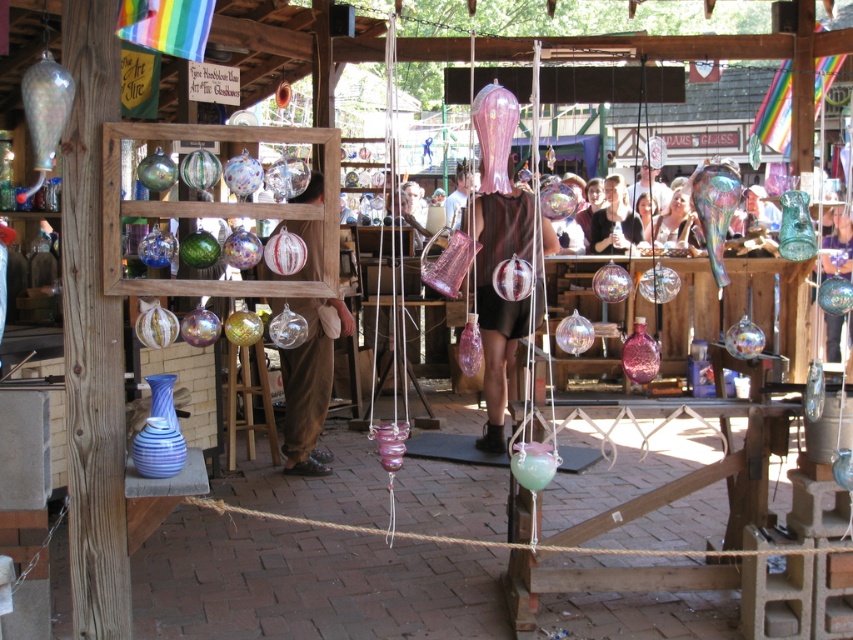
Question: Which of the following is the farthest from the observer?

Choices:
 (A) (500, 445)
 (B) (659, 227)

Answer: (B)

Question: Does matte brown pants at center appear over brown rope at center?

Choices:
 (A) no
 (B) yes

Answer: (B)

Question: Considering the real-world distances, which object is farthest from the matte brown pants at center?

Choices:
 (A) translucent glass vase at center
 (B) matte black dress at center
 (C) matte black shirt at center
 (D) translucent pink glass vase at center

Answer: (A)

Question: Is translucent pink glass vase at center closer to the viewer compared to matte brown pants at center?

Choices:
 (A) yes
 (B) no

Answer: (B)

Question: Does brown rope at center appear on the right side of matte black shirt at center?

Choices:
 (A) no
 (B) yes

Answer: (A)

Question: Which point is closer to the camera?

Choices:
 (A) (838, 234)
 (B) (515, 544)
 (C) (613, 188)

Answer: (B)